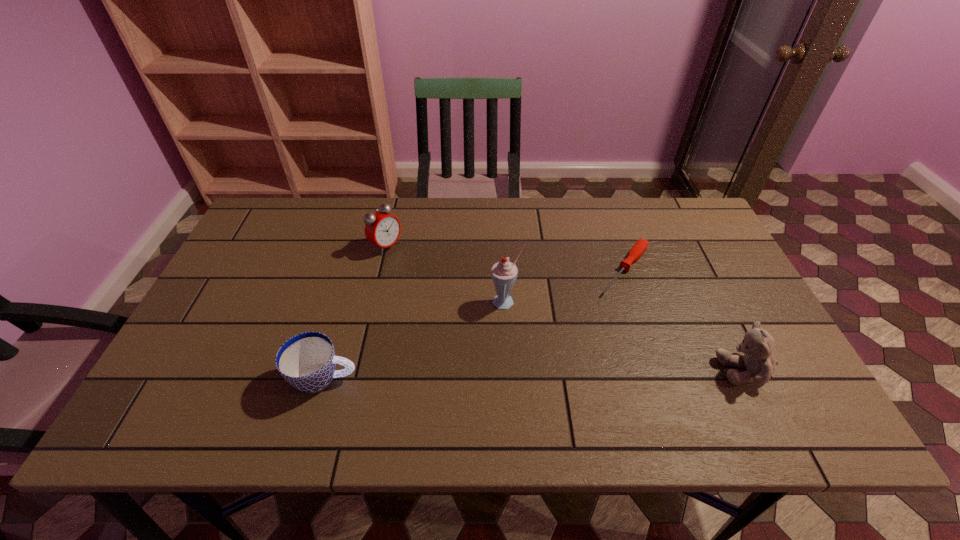
Identify the location of free space located on the face of the rightmost object. (636, 370).

The width and height of the screenshot is (960, 540). Identify the location of free region located 0.080m on the straw side of the third object from right to left. (520, 335).

Locate an element on the screen. This screenshot has width=960, height=540. vacant space located on the straw side of the third object from right to left is located at coordinates (527, 355).

Where is `vacant region located on the straw side of the third object from right to left`? The width and height of the screenshot is (960, 540). vacant region located on the straw side of the third object from right to left is located at coordinates (529, 358).

Where is `blank space located 0.130m at the tip of the screwdriver`? blank space located 0.130m at the tip of the screwdriver is located at coordinates (589, 320).

Where is `vacant region located at the tip of the screwdriver`? The height and width of the screenshot is (540, 960). vacant region located at the tip of the screwdriver is located at coordinates (569, 345).

This screenshot has width=960, height=540. I want to click on free space located at the tip of the screwdriver, so coord(584,327).

The height and width of the screenshot is (540, 960). What are the coordinates of `vacant region located 0.330m on the front-facing side of the alarm clock` in the screenshot? It's located at click(x=484, y=306).

Identify the location of vacant space located 0.130m on the front-facing side of the alarm clock. (429, 273).

This screenshot has width=960, height=540. Find the location of `free region located 0.170m on the front-facing side of the alarm clock`. free region located 0.170m on the front-facing side of the alarm clock is located at coordinates (440, 279).